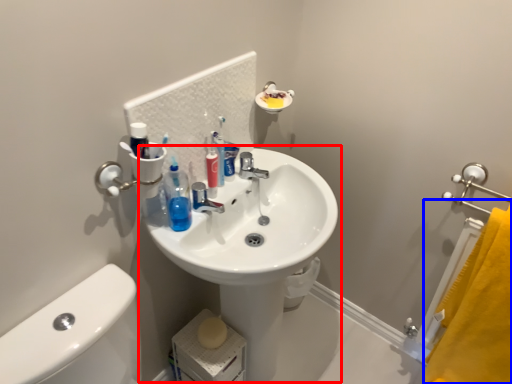
Question: Which object is further to the camera taking this photo, sink (highlighted by a red box) or bath towel (highlighted by a blue box)?

Choices:
 (A) sink
 (B) bath towel

Answer: (B)